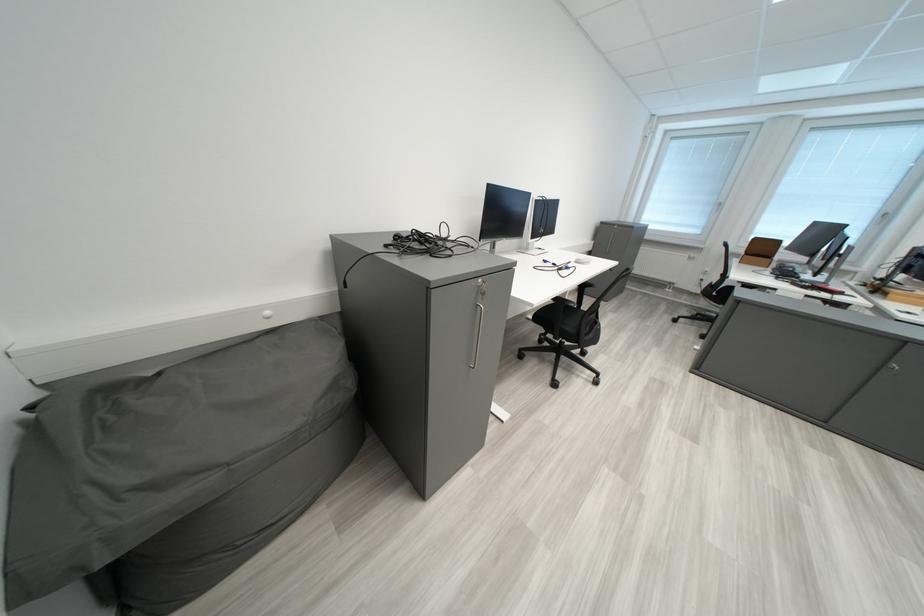
The image size is (924, 616). What are the coordinates of `brown cardboard box` in the screenshot? It's located at (760, 252).